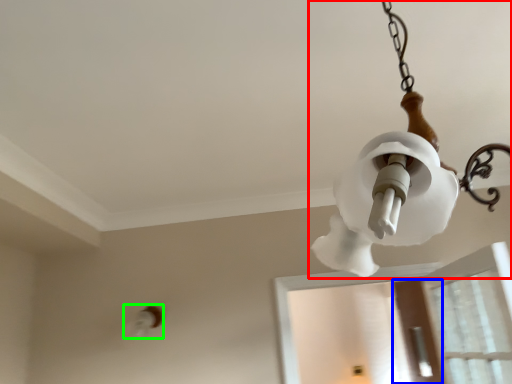
Question: Which is nearer to the lamp (highlighted by a red box)? screen door (highlighted by a blue box) or light fixture (highlighted by a green box).

Choices:
 (A) screen door
 (B) light fixture

Answer: (B)